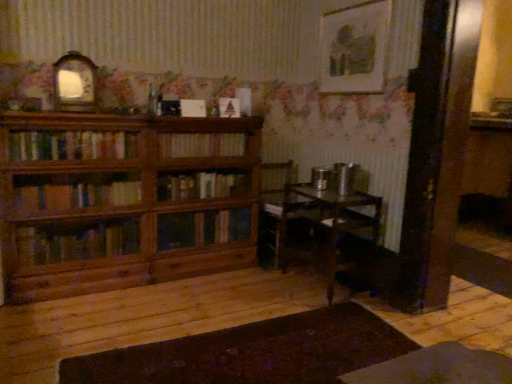
This screenshot has width=512, height=384. Find the location of `vacant area that lies to the right of wooden bookcase at left`. vacant area that lies to the right of wooden bookcase at left is located at coordinates (254, 304).